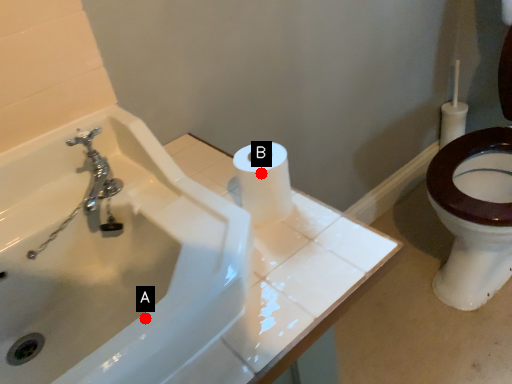
Question: Two points are circled on the image, labeled by A and B beside each circle. Among these points, which one is nearest to the camera?

Choices:
 (A) A is closer
 (B) B is closer

Answer: (A)